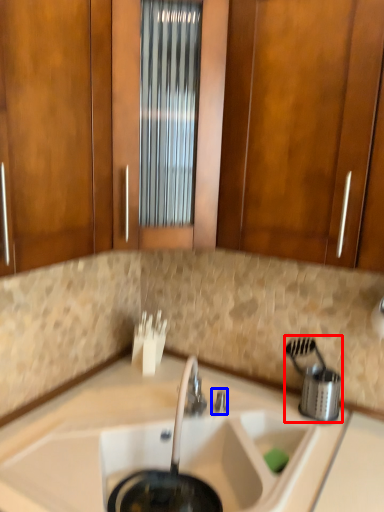
Question: Which object appears farthest to the camera in this image, appliance (highlighted by a red box) or faucet (highlighted by a blue box)?

Choices:
 (A) appliance
 (B) faucet

Answer: (B)